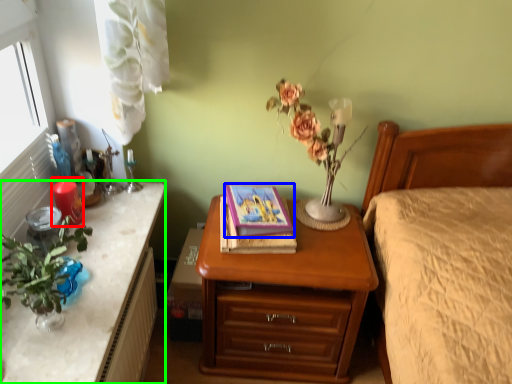
Question: Based on their relative distances, which object is farther from candle (highlighted by a red box)? Choose from book (highlighted by a blue box) and desk (highlighted by a green box).

Choices:
 (A) book
 (B) desk

Answer: (A)